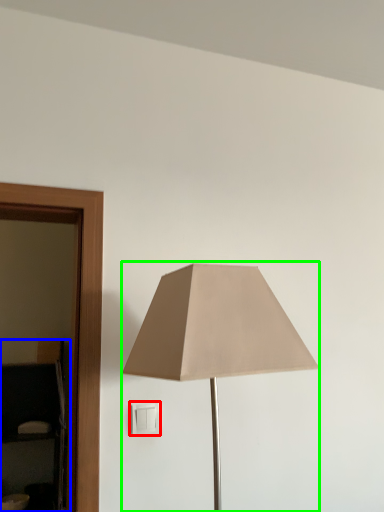
Question: Which object is the farthest from light switch (highlighted by a red box)? Choose among these: dresser (highlighted by a blue box) or lamp (highlighted by a green box).

Choices:
 (A) dresser
 (B) lamp

Answer: (A)